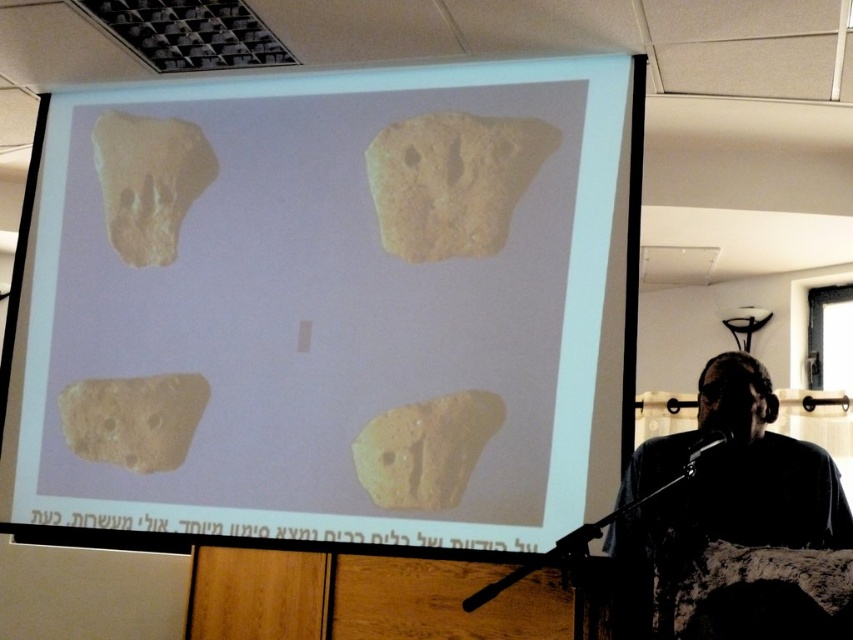
You are organizing a museum exhibit and need to arrange two artifacts, the yellowish stone at center and the brown matte stone at lower left, in a display case. Based on their positions in the projected image, which artifact should be placed to the right side of the other?

The yellowish stone at center should be placed to the right side of the brown matte stone at lower left because in the projected image, the yellowish stone at center is positioned on the right side of brown matte stone at lower left.

You are an archaeologist examining the artifacts displayed on the screen. You need to determine which stone is thinner between the yellow matte stone at lower center and the brown matte stone at lower left. Which one is thinner?

The yellow matte stone at lower center is thinner than the brown matte stone at lower left according to the description.

A presenter is standing between the yellow matte stone at lower center and the projection screen. If the presenter wants to move closer to the screen without stepping on the stone, how much distance do they need to cover?

The presenter needs to cover 9.26 feet to reach the screen without stepping on the yellow matte stone at lower center.